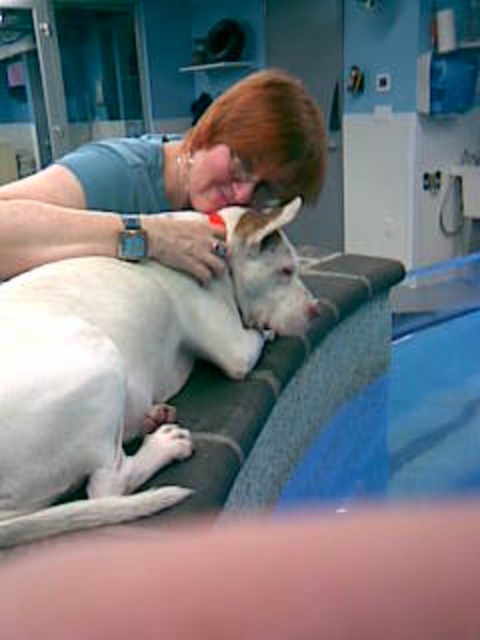
Between white smooth dog at center and matte gray shirt at upper center, which one has more height?

Standing taller between the two is white smooth dog at center.

Who is more distant from viewer, (27, 348) or (149, 196)?

Positioned behind is point (149, 196).

Where is `white smooth dog at center`? white smooth dog at center is located at coordinates (124, 369).